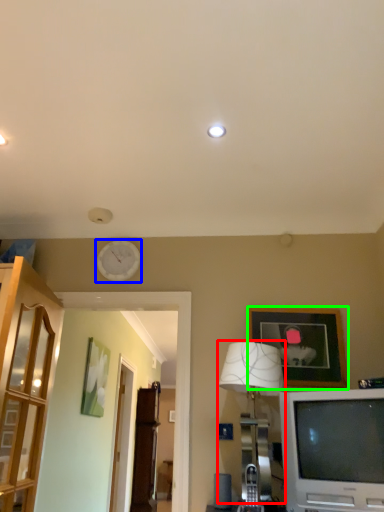
Question: Which is farther away from lamp (highlighted by a red box)? clock (highlighted by a blue box) or picture frame (highlighted by a green box)?

Choices:
 (A) clock
 (B) picture frame

Answer: (A)